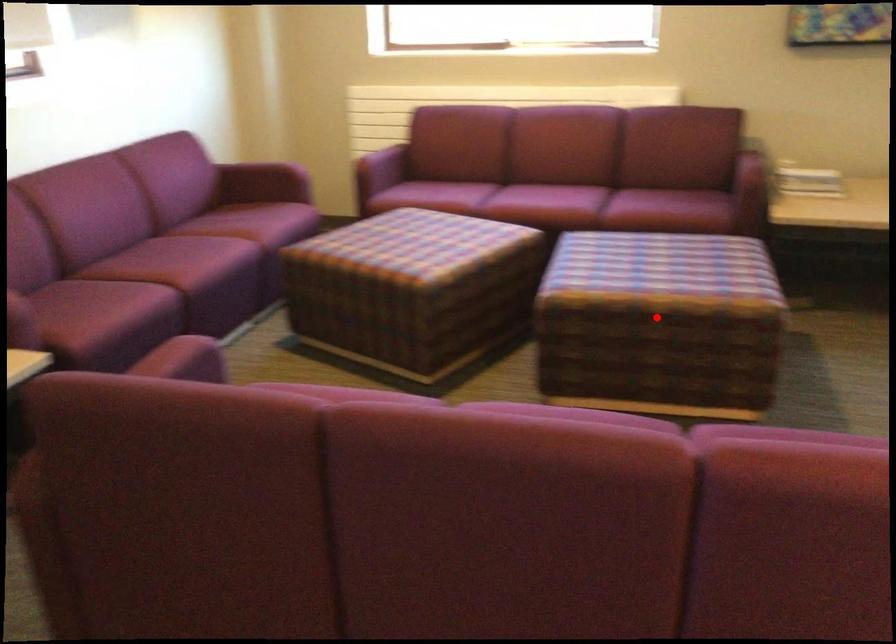
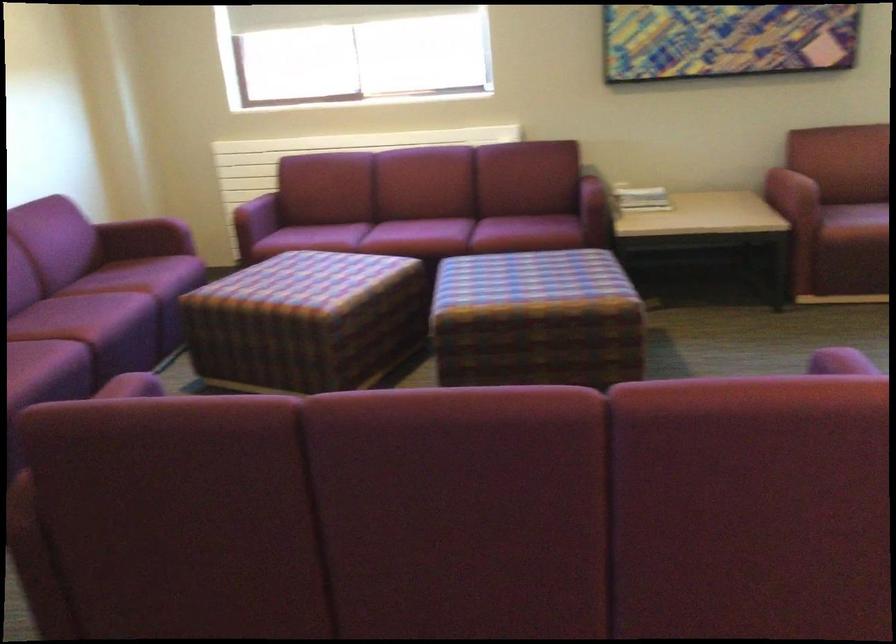
Question: A red point is marked in image1. In image2, is the corresponding 3D point closer to the camera or farther? Reply with the corresponding letter.

Choices:
 (A) The corresponding 3D point is closer.
 (B) The corresponding 3D point is farther.

Answer: (B)